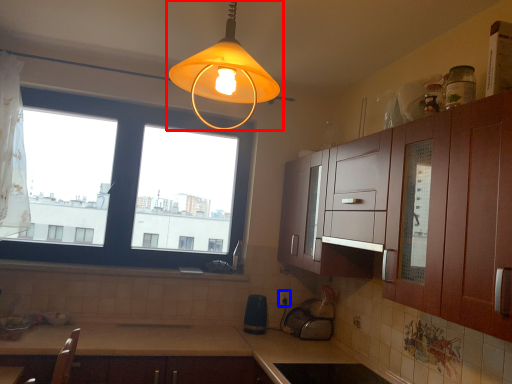
Question: Which of the following is the farthest to the observer, lamp (highlighted by a red box) or electric outlet (highlighted by a blue box)?

Choices:
 (A) lamp
 (B) electric outlet

Answer: (B)